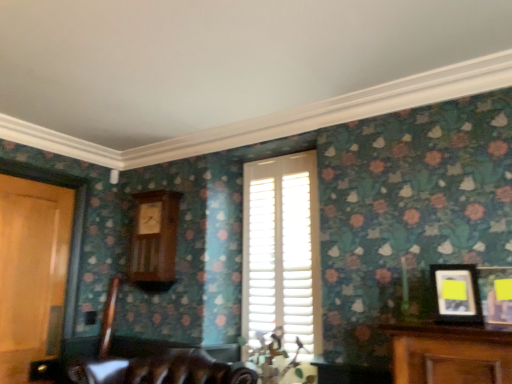
Question: Is white wooden shutters at center thinner than yellow matte picture frame at right, positioned as the 1th picture frame in right-to-left order?

Choices:
 (A) yes
 (B) no

Answer: (A)

Question: Considering the relative positions of white wooden shutters at center and yellow matte picture frame at right, the second picture frame viewed from the left, in the image provided, is white wooden shutters at center to the right of yellow matte picture frame at right, the second picture frame viewed from the left, from the viewer's perspective?

Choices:
 (A) yes
 (B) no

Answer: (B)

Question: Does white wooden shutters at center have a lesser height compared to yellow matte picture frame at right, positioned as the 1th picture frame in right-to-left order?

Choices:
 (A) no
 (B) yes

Answer: (A)

Question: From a real-world perspective, is white wooden shutters at center on top of yellow matte picture frame at right, positioned as the 1th picture frame in right-to-left order?

Choices:
 (A) yes
 (B) no

Answer: (A)

Question: Is white wooden shutters at center further to camera compared to yellow matte picture frame at right, the second picture frame viewed from the left?

Choices:
 (A) no
 (B) yes

Answer: (B)

Question: From the image's perspective, is yellow matte picture frame at right, positioned as the 1th picture frame in right-to-left order, positioned above or below wooden door at left?

Choices:
 (A) below
 (B) above

Answer: (B)

Question: Is yellow matte picture frame at right, the second picture frame viewed from the left, situated inside wooden door at left or outside?

Choices:
 (A) inside
 (B) outside

Answer: (B)

Question: Based on their sizes in the image, would you say yellow matte picture frame at right, positioned as the 1th picture frame in right-to-left order, is bigger or smaller than wooden door at left?

Choices:
 (A) big
 (B) small

Answer: (B)

Question: Considering the positions of yellow matte picture frame at right, the second picture frame viewed from the left, and wooden door at left in the image, is yellow matte picture frame at right, the second picture frame viewed from the left, taller or shorter than wooden door at left?

Choices:
 (A) short
 (B) tall

Answer: (A)

Question: Considering the positions of point (158, 236) and point (31, 233), is point (158, 236) closer or farther from the camera than point (31, 233)?

Choices:
 (A) farther
 (B) closer

Answer: (A)

Question: From the image's perspective, is wooden clock at center-left above or below wooden door at left?

Choices:
 (A) above
 (B) below

Answer: (A)

Question: In terms of size, does wooden clock at center-left appear bigger or smaller than wooden door at left?

Choices:
 (A) big
 (B) small

Answer: (B)

Question: From a real-world perspective, relative to wooden door at left, is wooden clock at center-left vertically above or below?

Choices:
 (A) above
 (B) below

Answer: (A)

Question: From the image's perspective, is white wooden shutters at center positioned above or below yellow matte picture frame at right, positioned as the 1th picture frame in right-to-left order?

Choices:
 (A) above
 (B) below

Answer: (B)

Question: Looking at their shapes, would you say white wooden shutters at center is wider or thinner than yellow matte picture frame at right, the second picture frame viewed from the left?

Choices:
 (A) thin
 (B) wide

Answer: (A)